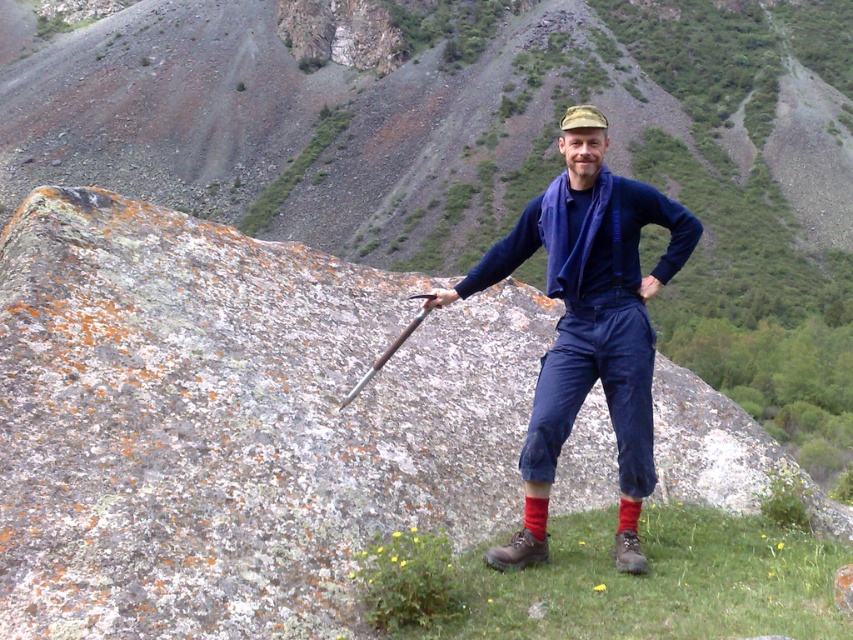
Can you confirm if blue fabric shirt at center is shorter than brown suede boot at lower right?

No, blue fabric shirt at center is not shorter than brown suede boot at lower right.

Between blue fabric shirt at center and brown suede boot at lower right, which one appears on the left side from the viewer's perspective?

brown suede boot at lower right

Between point (524, 456) and point (621, 552), which one is positioned behind?

The point (621, 552) is more distant.

Identify the location of blue fabric shirt at center. The image size is (853, 640). [589, 307].

Image resolution: width=853 pixels, height=640 pixels. What do you see at coordinates (517, 552) in the screenshot? I see `brown leather boot at lower center` at bounding box center [517, 552].

Looking at this image, can you confirm if brown leather boot at lower center is positioned above shiny metal pole at center?

No.

Locate an element on the screen. The width and height of the screenshot is (853, 640). brown leather boot at lower center is located at coordinates (517, 552).

Identify the location of brown leather boot at lower center. (517, 552).

Is blue fabric shirt at center positioned behind shiny metal pole at center?

No.

What do you see at coordinates (589, 307) in the screenshot? Image resolution: width=853 pixels, height=640 pixels. I see `blue fabric shirt at center` at bounding box center [589, 307].

You are a GUI agent. You are given a task and a screenshot of the screen. Output one action in this format:
    pyautogui.click(x=<x>, y=<y>)
    Task: Click on the blue fabric shirt at center
    The height and width of the screenshot is (640, 853).
    Given the screenshot: What is the action you would take?
    pyautogui.click(x=589, y=307)